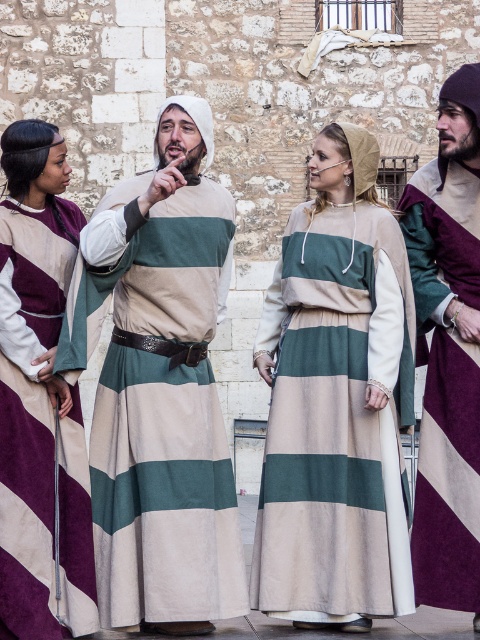
Question: Is green striped tunic at center below velvet purple robe at left?

Choices:
 (A) yes
 (B) no

Answer: (B)

Question: Is matte beige and green striped dress at center to the right of maroon suede tunic at right from the viewer's perspective?

Choices:
 (A) yes
 (B) no

Answer: (B)

Question: Which point is closer to the camera?

Choices:
 (A) maroon suede tunic at right
 (B) matte beige and green striped dress at center

Answer: (B)

Question: Which is farther from the matte beige and green striped dress at center?

Choices:
 (A) maroon suede tunic at right
 (B) velvet purple robe at left
 (C) green striped tunic at center

Answer: (B)

Question: Can you confirm if green striped tunic at center is positioned to the right of maroon suede tunic at right?

Choices:
 (A) yes
 (B) no

Answer: (B)

Question: Which is farther from the maroon suede tunic at right?

Choices:
 (A) green striped tunic at center
 (B) matte beige and green striped dress at center

Answer: (A)